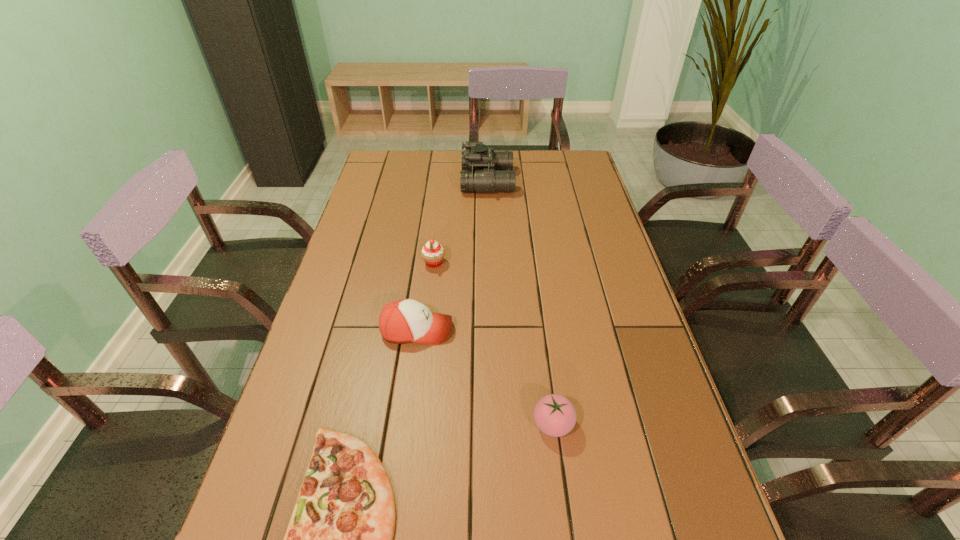
The height and width of the screenshot is (540, 960). What are the coordinates of `vacant region between the cupcake and the tallest object` in the screenshot? It's located at (461, 222).

This screenshot has width=960, height=540. Find the location of `object that is the closest to the pizza`. object that is the closest to the pizza is located at coordinates (405, 320).

The height and width of the screenshot is (540, 960). I want to click on object identified as the fourth closest to the third nearest object, so click(484, 170).

Locate an element on the screen. The height and width of the screenshot is (540, 960). free space that satisfies the following two spatial constraints: 1. through the lenses of the binoculars; 2. on the left side of the tomato is located at coordinates (493, 424).

The image size is (960, 540). In order to click on vacant space that satisfies the following two spatial constraints: 1. through the lenses of the farthest object; 2. on the front side of the second farthest object in this screenshot , I will do `click(490, 263)`.

This screenshot has height=540, width=960. Identify the location of free space that satisfies the following two spatial constraints: 1. through the lenses of the binoculars; 2. on the left side of the second shortest object. (493, 424).

You are a GUI agent. You are given a task and a screenshot of the screen. Output one action in this format:
    pyautogui.click(x=<x>, y=<y>)
    Task: Click on the vacant region that satisfies the following two spatial constraints: 1. through the lenses of the second shortest object; 2. on the right side of the tallest object
    This screenshot has width=960, height=540.
    Given the screenshot: What is the action you would take?
    pyautogui.click(x=493, y=424)

Where is `vacant region that satisfies the following two spatial constraints: 1. through the lenses of the tomato; 2. on the left side of the binoculars`? The height and width of the screenshot is (540, 960). vacant region that satisfies the following two spatial constraints: 1. through the lenses of the tomato; 2. on the left side of the binoculars is located at coordinates (493, 424).